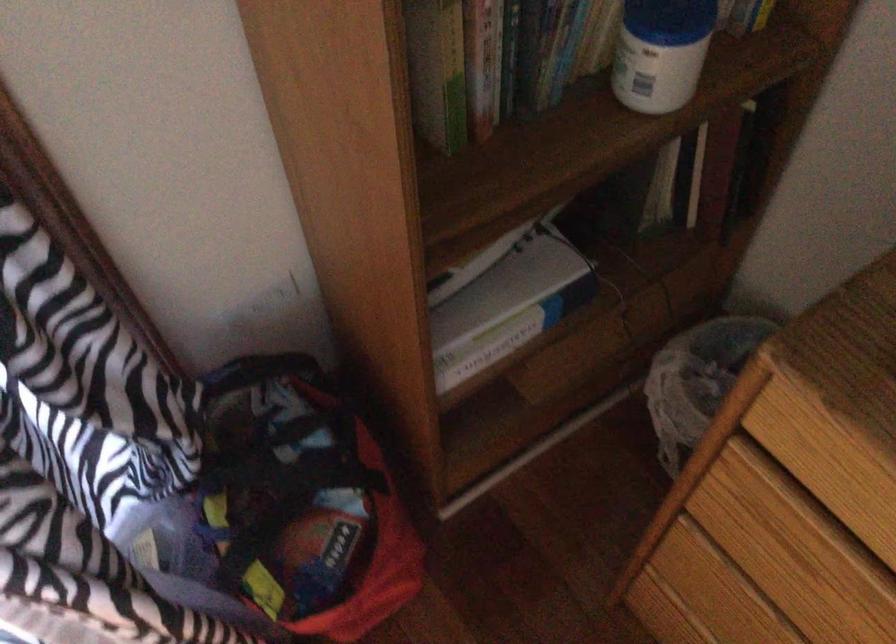
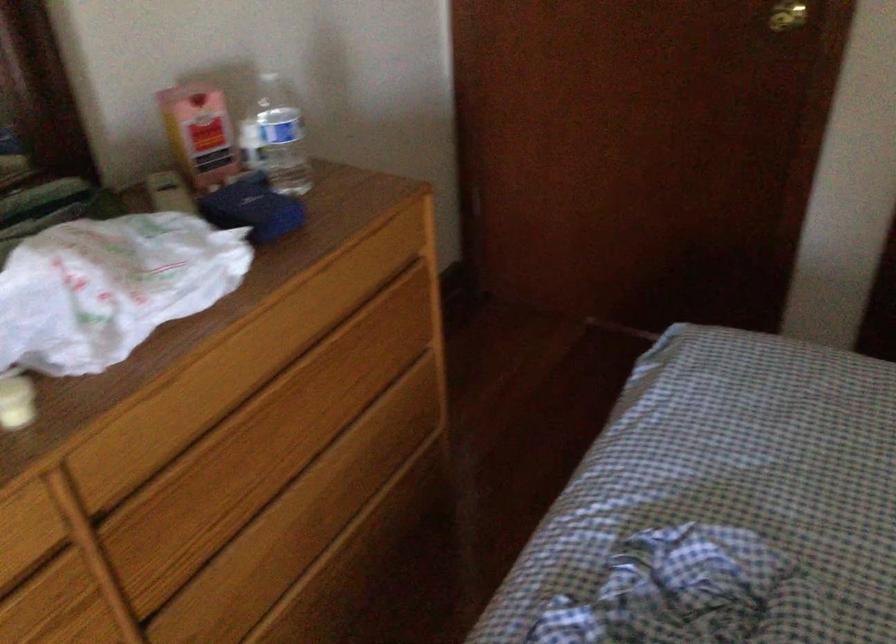
The images are taken continuously from a first-person perspective. In which direction is your viewpoint rotating?

The camera rotated toward right-down.